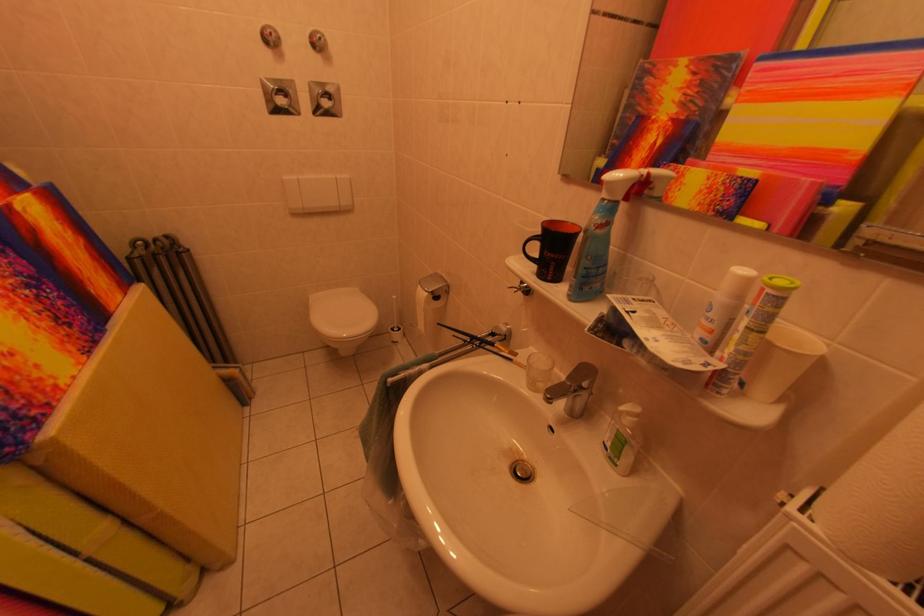
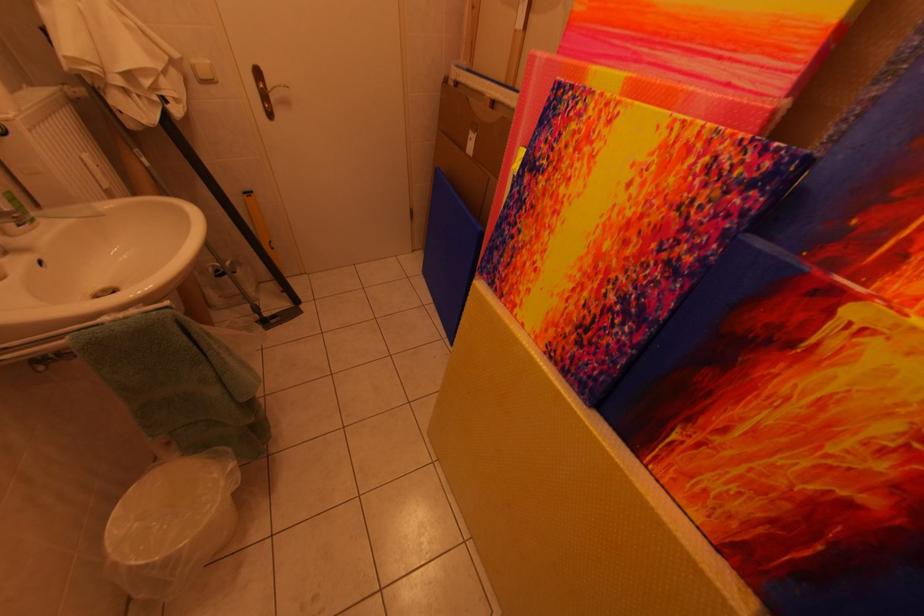
Find the pixel in the second image that matches point (27, 213) in the first image.

(861, 317)